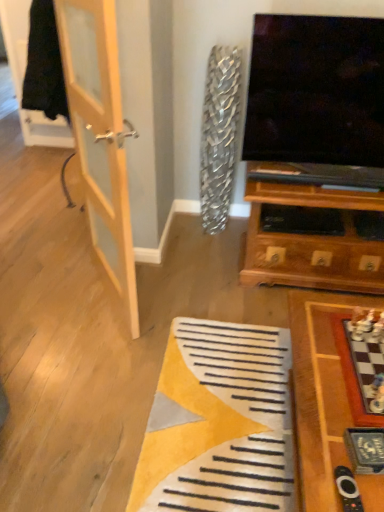
Question: Does black plastic remote at lower right lie in front of wooden chessboard at lower right?

Choices:
 (A) yes
 (B) no

Answer: (A)

Question: From a real-world perspective, does black plastic remote at lower right stand above wooden chessboard at lower right?

Choices:
 (A) yes
 (B) no

Answer: (A)

Question: Does black plastic remote at lower right have a greater width compared to wooden chessboard at lower right?

Choices:
 (A) no
 (B) yes

Answer: (A)

Question: Considering the relative sizes of black plastic remote at lower right and wooden chessboard at lower right in the image provided, is black plastic remote at lower right bigger than wooden chessboard at lower right?

Choices:
 (A) yes
 (B) no

Answer: (B)

Question: Does black plastic remote at lower right appear on the left side of wooden chessboard at lower right?

Choices:
 (A) yes
 (B) no

Answer: (A)

Question: Is black plastic remote at lower right shorter than wooden chessboard at lower right?

Choices:
 (A) yes
 (B) no

Answer: (A)

Question: From a real-world perspective, is black plastic remote at lower right physically above light wood door at left?

Choices:
 (A) yes
 (B) no

Answer: (B)

Question: Does black plastic remote at lower right have a smaller size compared to light wood door at left?

Choices:
 (A) no
 (B) yes

Answer: (B)

Question: Is black plastic remote at lower right shorter than light wood door at left?

Choices:
 (A) no
 (B) yes

Answer: (B)

Question: Considering the relative sizes of black plastic remote at lower right and light wood door at left in the image provided, is black plastic remote at lower right taller than light wood door at left?

Choices:
 (A) yes
 (B) no

Answer: (B)

Question: Can you confirm if black plastic remote at lower right is thinner than light wood door at left?

Choices:
 (A) no
 (B) yes

Answer: (A)

Question: Is black plastic remote at lower right wider than light wood door at left?

Choices:
 (A) no
 (B) yes

Answer: (B)

Question: Considering the relative sizes of wooden chessboard at lower right and light wood door at left in the image provided, is wooden chessboard at lower right shorter than light wood door at left?

Choices:
 (A) no
 (B) yes

Answer: (B)